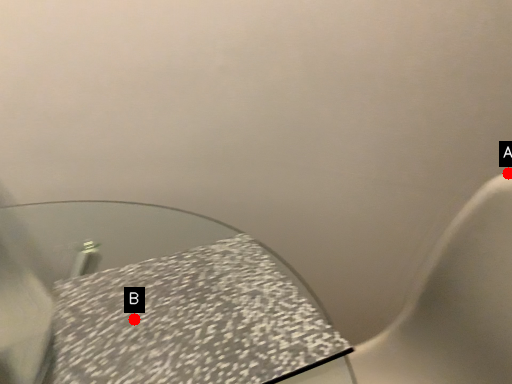
Question: Two points are circled on the image, labeled by A and B beside each circle. Among these points, which one is nearest to the camera?

Choices:
 (A) A is closer
 (B) B is closer

Answer: (B)